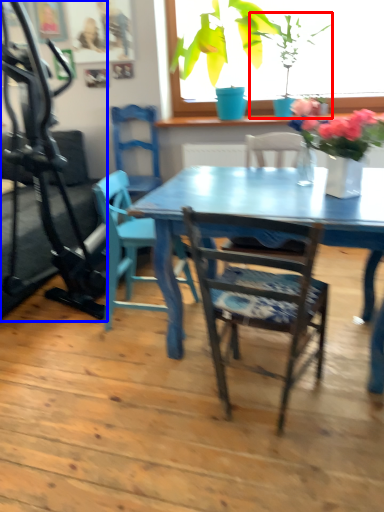
Question: Among these objects, which one is farthest to the camera, houseplant (highlighted by a red box) or treadmill (highlighted by a blue box)?

Choices:
 (A) houseplant
 (B) treadmill

Answer: (A)